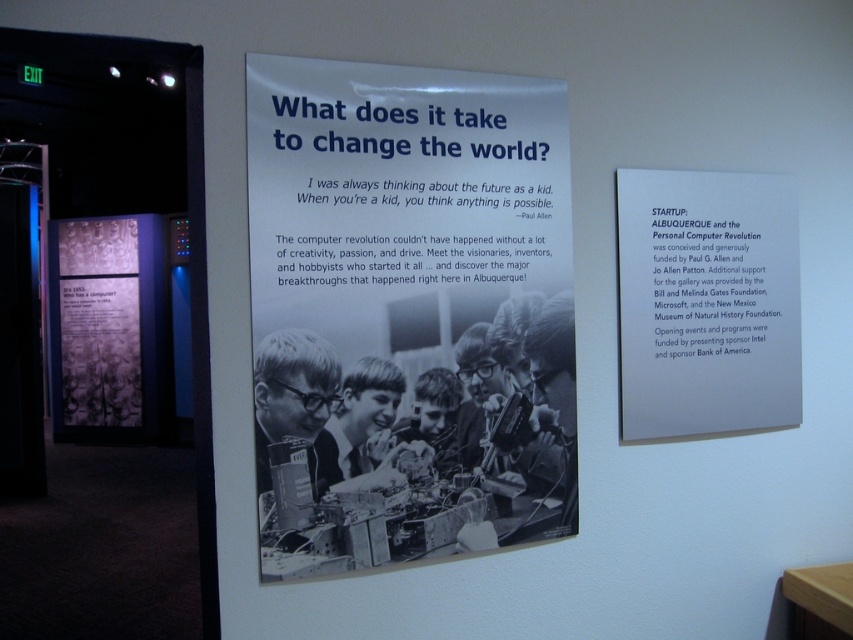
You are a visitor standing in front of the exhibit display. You notice a white paper at upper right. If you want to read the text on it, will you be able to do so without moving closer than 1.82 meters?

The white paper at upper right is 1.82 meters away from you. To read the text on it, you would need to move closer than that distance.

From the picture: You are an interior designer planning to hang a new artwork in this museum exhibit. You have a painting that is 1.2 meters wide. The current display has the black paper poster at center and the translucent purple text at center. Which object in the current display has a width that could potentially allow your painting to fit alongside it without overlapping?

The black paper poster at center has a width less than the translucent purple text at center. Since your painting is 1.2 meters wide, it might fit alongside the black paper poster at center if its width is less than 1.2 meters, but you need to check the exact dimensions.

You are standing in front of an exhibit display in a museum. There is a black paper poster at center. If you want to read the text on the poster clearly, should you move closer or farther away?

The black paper poster at center is 5.05 feet away from you. To read the text clearly, you should move closer because the standard comfortable reading distance for most adults is around 14 to 16 inches, which is much closer than 5.05 feet.